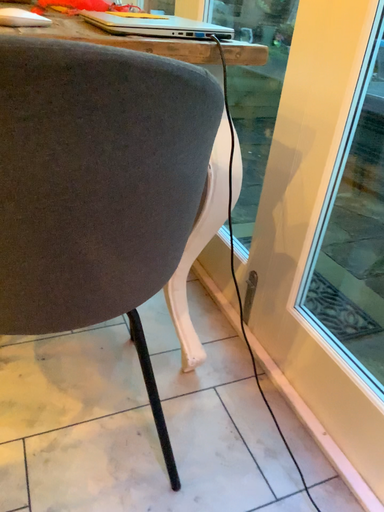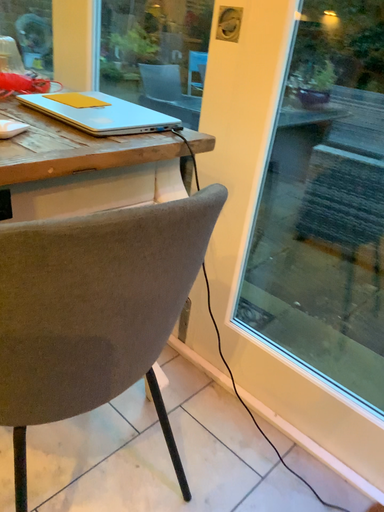
Question: Which way did the camera rotate in the video?

Choices:
 (A) rotated right
 (B) rotated left

Answer: (A)